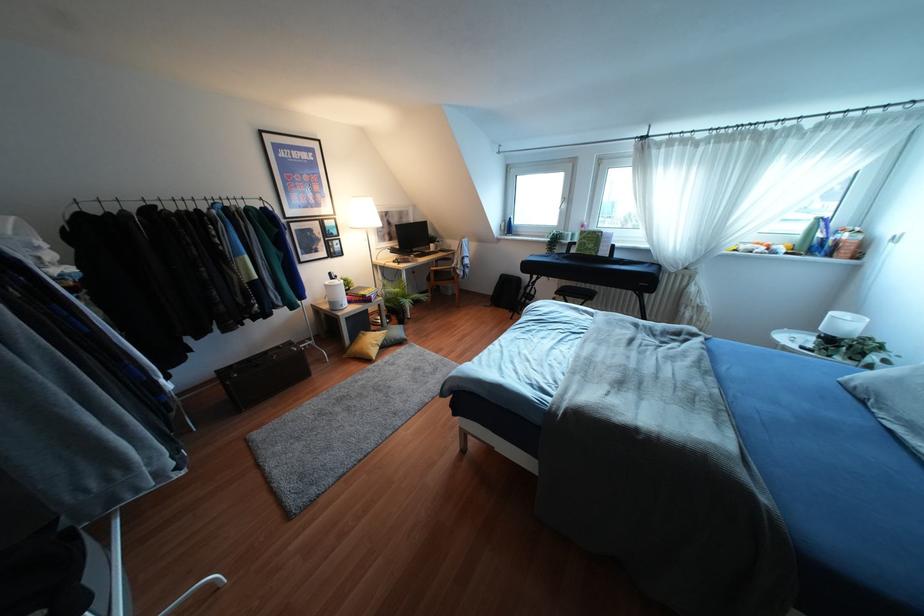
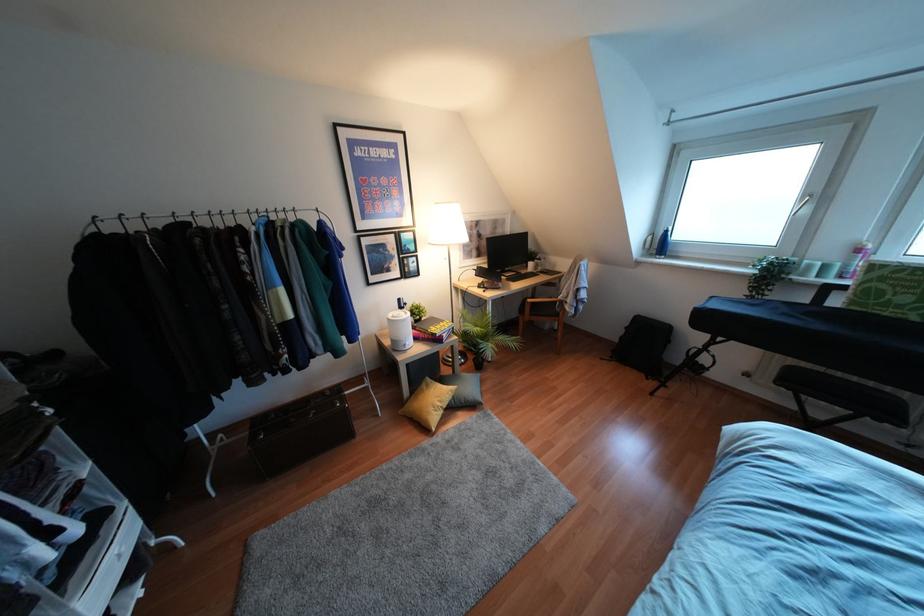
The point at (572, 235) is marked in the first image. Where is the corresponding point in the second image?

(824, 267)